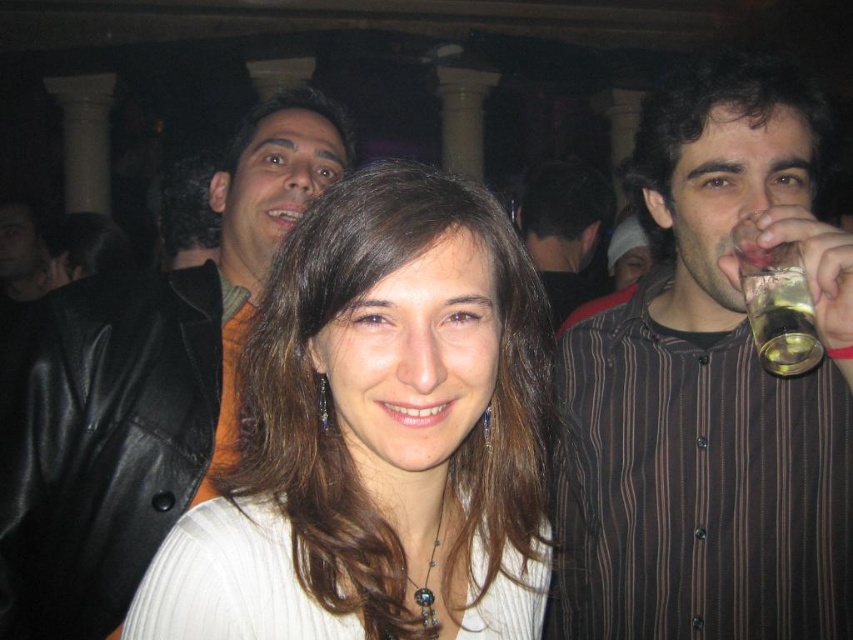
You are at a party and want to take a photo of the black leather jacket at upper left and the translucent glass at upper right. Which object will appear larger in the photo?

The black leather jacket at upper left is much taller than the translucent glass at upper right, so it will appear larger in the photo.

You are at a party and want to hand a drink to both the brown striped shirt at right and the matte black shirt at upper center. If you are standing at the center of the room, which direction should you face to first reach the closer one?

The brown striped shirt at right is 1.95 meters away from matte black shirt at upper center. Since you are at the center, the matte black shirt at upper center is closer, so you should face towards the upper center direction first.